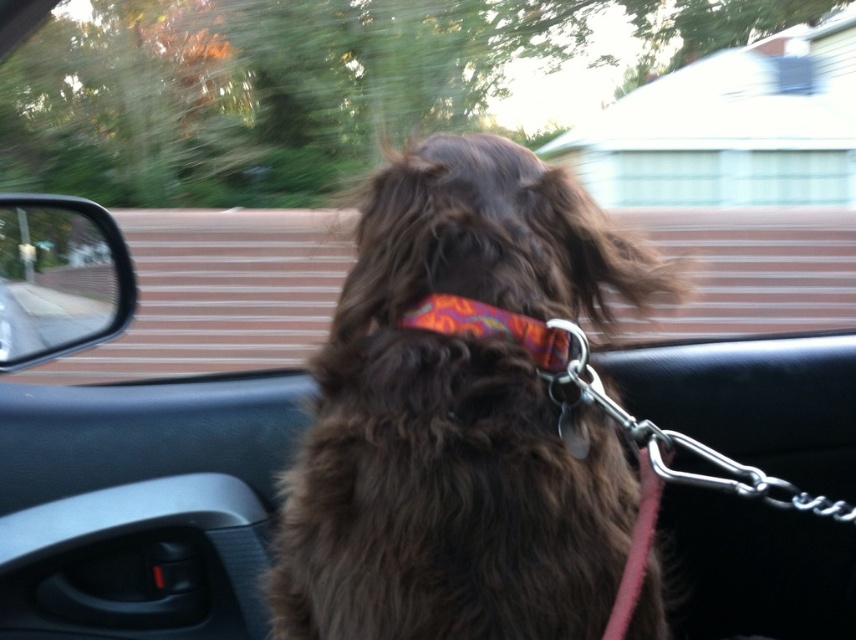
From the picture: Can you confirm if brown furry dog at center is shorter than multicolored fabric neckband at center?

No.

Does brown furry dog at center appear under multicolored fabric neckband at center?

Correct, brown furry dog at center is located below multicolored fabric neckband at center.

Which is behind, point (302, 627) or point (557, 340)?

The point (557, 340) is more distant.

You are a GUI agent. You are given a task and a screenshot of the screen. Output one action in this format:
    pyautogui.click(x=<x>, y=<y>)
    Task: Click on the brown furry dog at center
    Image resolution: width=856 pixels, height=640 pixels.
    Given the screenshot: What is the action you would take?
    pyautogui.click(x=461, y=413)

Can you confirm if brown furry dog at center is shorter than clear glass window at upper left?

In fact, brown furry dog at center may be taller than clear glass window at upper left.

Does brown furry dog at center have a smaller size compared to clear glass window at upper left?

No, brown furry dog at center is not smaller than clear glass window at upper left.

Where is `brown furry dog at center`? brown furry dog at center is located at coordinates (461, 413).

At what (x,y) coordinates should I click in order to perform the action: click on brown furry dog at center. Please return your answer as a coordinate pair (x, y). Looking at the image, I should click on (461, 413).

Does clear glass window at upper left have a lesser height compared to multicolored fabric neckband at center?

Incorrect, clear glass window at upper left's height does not fall short of multicolored fabric neckband at center's.

Between clear glass window at upper left and multicolored fabric neckband at center, which one appears on the left side from the viewer's perspective?

Positioned to the left is clear glass window at upper left.

Where is `clear glass window at upper left`? The image size is (856, 640). clear glass window at upper left is located at coordinates (58, 276).

Where is `clear glass window at upper left`? Image resolution: width=856 pixels, height=640 pixels. clear glass window at upper left is located at coordinates (58, 276).